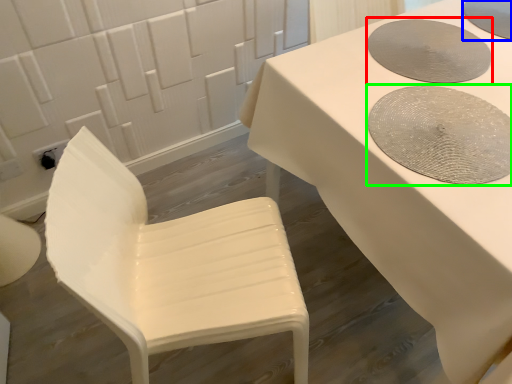
Question: Based on their relative distances, which object is farther from manhole cover (highlighted by a red box)? Choose from manhole cover (highlighted by a blue box) and manhole cover (highlighted by a green box).

Choices:
 (A) manhole cover
 (B) manhole cover

Answer: (A)